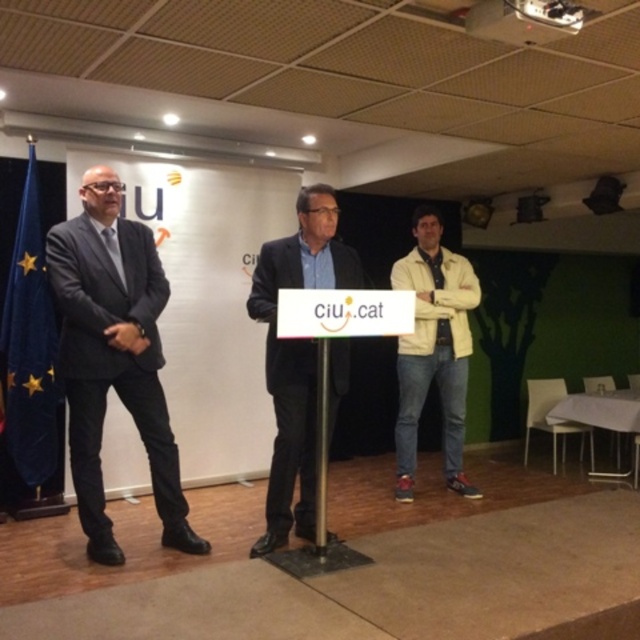
How distant is dark suit at center from light beige jacket at center?

dark suit at center and light beige jacket at center are 4.16 feet apart from each other.

Can you confirm if dark suit at center is bigger than light beige jacket at center?

Actually, dark suit at center might be smaller than light beige jacket at center.

Where is `dark suit at center`? The width and height of the screenshot is (640, 640). dark suit at center is located at coordinates coord(296,356).

Where is `dark suit at center`? The height and width of the screenshot is (640, 640). dark suit at center is located at coordinates (296, 356).

Who is positioned more to the right, dark gray suit at left or light beige jacket at center?

From the viewer's perspective, light beige jacket at center appears more on the right side.

Which is below, dark gray suit at left or light beige jacket at center?

light beige jacket at center is lower down.

Locate an element on the screen. dark gray suit at left is located at coordinates (113, 356).

Can you confirm if dark suit at center is thinner than blue fabric flag at left?

Incorrect, dark suit at center's width is not less than blue fabric flag at left's.

This screenshot has width=640, height=640. What are the coordinates of `dark suit at center` in the screenshot? It's located at (296, 356).

In order to click on dark suit at center in this screenshot , I will do `click(296, 356)`.